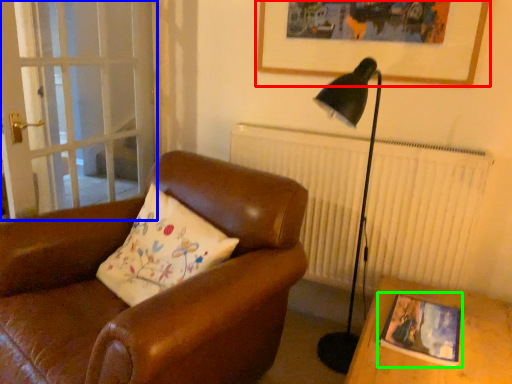
Question: Which object is the farthest from picture frame (highlighted by a red box)? Choose among these: screen door (highlighted by a blue box) or picture frame (highlighted by a green box).

Choices:
 (A) screen door
 (B) picture frame

Answer: (A)